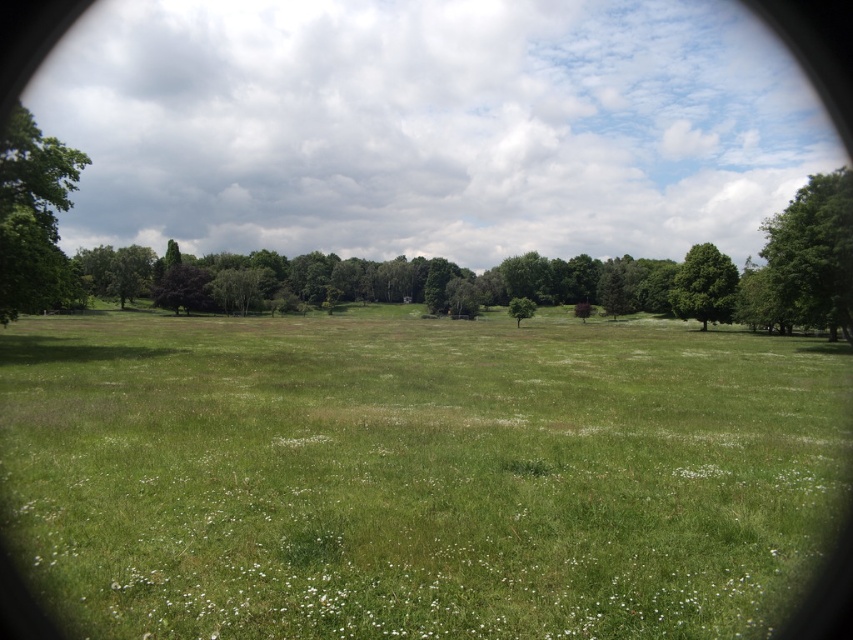
Question: Does green leafy tree at right appear on the right side of green leafy tree at upper right?

Choices:
 (A) yes
 (B) no

Answer: (B)

Question: Based on their relative distances, which object is farther from the green leafy tree at right?

Choices:
 (A) green leafy tree at left
 (B) green leafy tree at center

Answer: (A)

Question: Which of the following is the closest to the observer?

Choices:
 (A) 793,248
 (B) 512,308
 (C) 172,570
 (D) 697,252

Answer: (C)

Question: Does green grassy field at center have a greater width compared to green leafy tree at center?

Choices:
 (A) yes
 (B) no

Answer: (A)

Question: Which of the following is the closest to the observer?

Choices:
 (A) green leafy tree at center
 (B) green leafy tree at upper right

Answer: (B)

Question: Is green grassy field at center in front of green leafy tree at center?

Choices:
 (A) no
 (B) yes

Answer: (B)